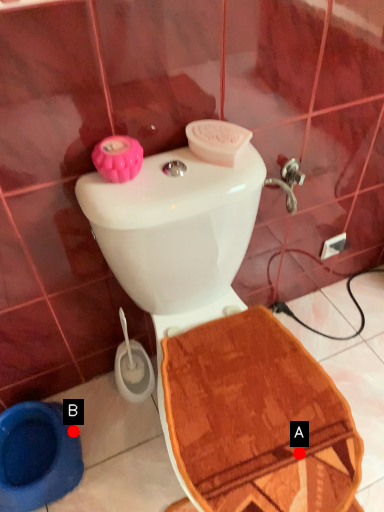
Question: Two points are circled on the image, labeled by A and B beside each circle. Which point appears closest to the camera in this image?

Choices:
 (A) A is closer
 (B) B is closer

Answer: (A)